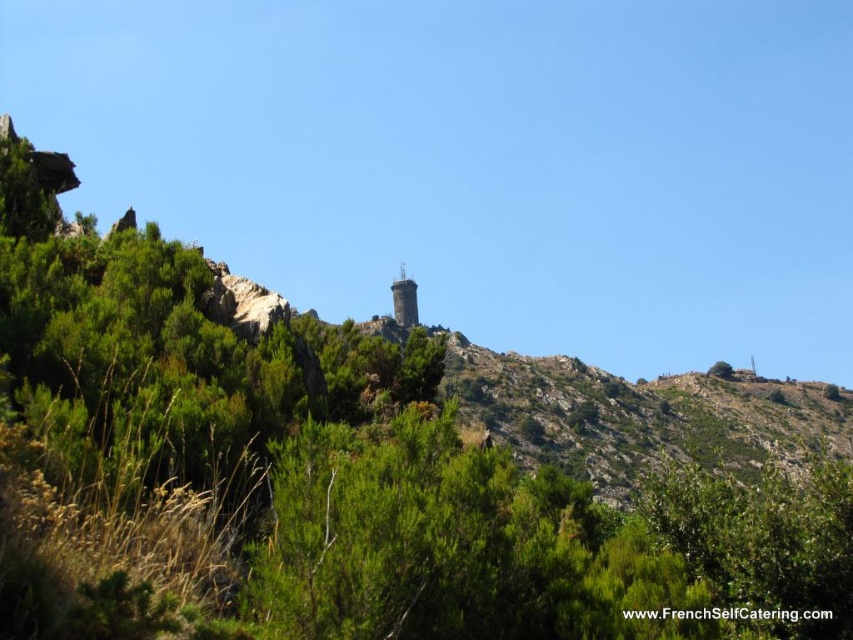
Which is below, brown stone tower at center or green leafy tree at upper right?

green leafy tree at upper right is lower down.

Which of these two, brown stone tower at center or green leafy tree at upper right, stands taller?

brown stone tower at center

Who is more distant from viewer, (410, 304) or (717, 362)?

Positioned behind is point (717, 362).

Where is `brown stone tower at center`? This screenshot has height=640, width=853. brown stone tower at center is located at coordinates (404, 300).